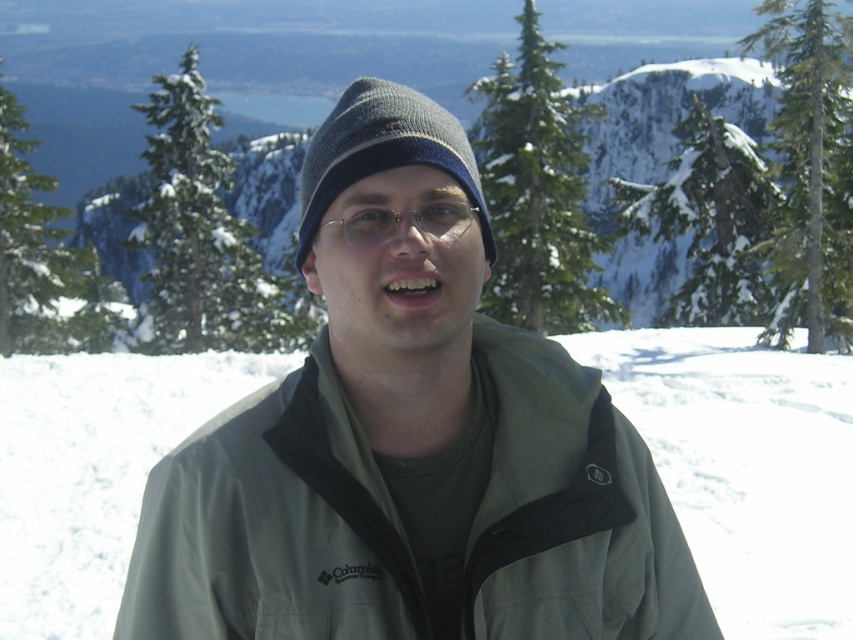
Question: Considering the real-world distances, which object is farthest from the knit woolen beanie at center?

Choices:
 (A) green textured pine at upper center
 (B) green fabric jacket at center
 (C) snowy mountain at center

Answer: (C)

Question: Which point is closer to the camera?

Choices:
 (A) green textured pine at upper center
 (B) clear plastic glasses at center

Answer: (B)

Question: Which point is closer to the camera taking this photo?

Choices:
 (A) (367, 230)
 (B) (521, 321)
 (C) (662, 122)
 (D) (494, 525)

Answer: (A)

Question: Is knit woolen beanie at center thinner than clear plastic glasses at center?

Choices:
 (A) no
 (B) yes

Answer: (A)

Question: From the image, what is the correct spatial relationship of green textured pine at upper center in relation to green textured pine at upper right?

Choices:
 (A) right
 (B) left

Answer: (B)

Question: Does green fabric jacket at center appear on the left side of green textured pine at upper right?

Choices:
 (A) no
 (B) yes

Answer: (B)